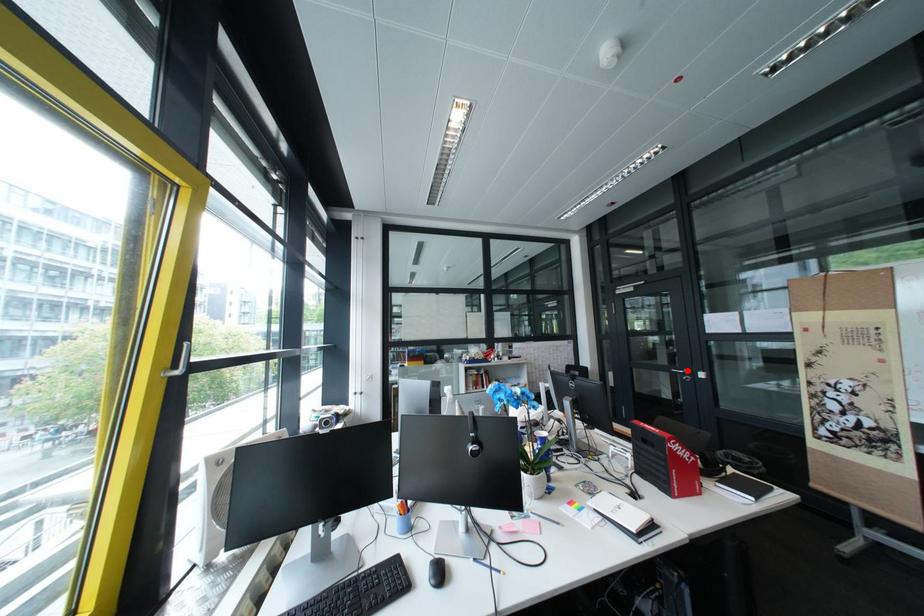
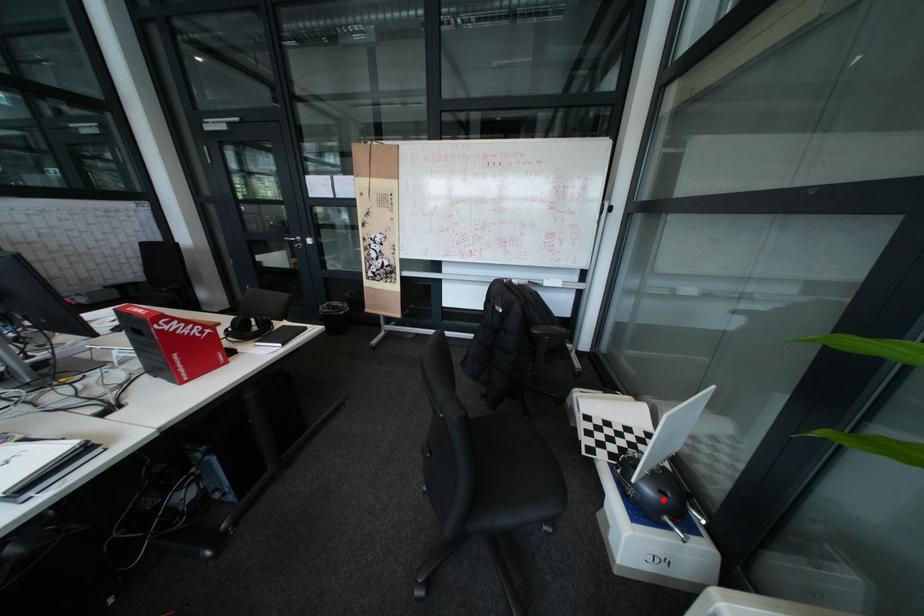
I am providing you with two images of the same scene from different viewpoints. A red point is marked on the first image and another point is marked on the second image. Are the points marked in image1 and image2 representing the same 3D position?

No